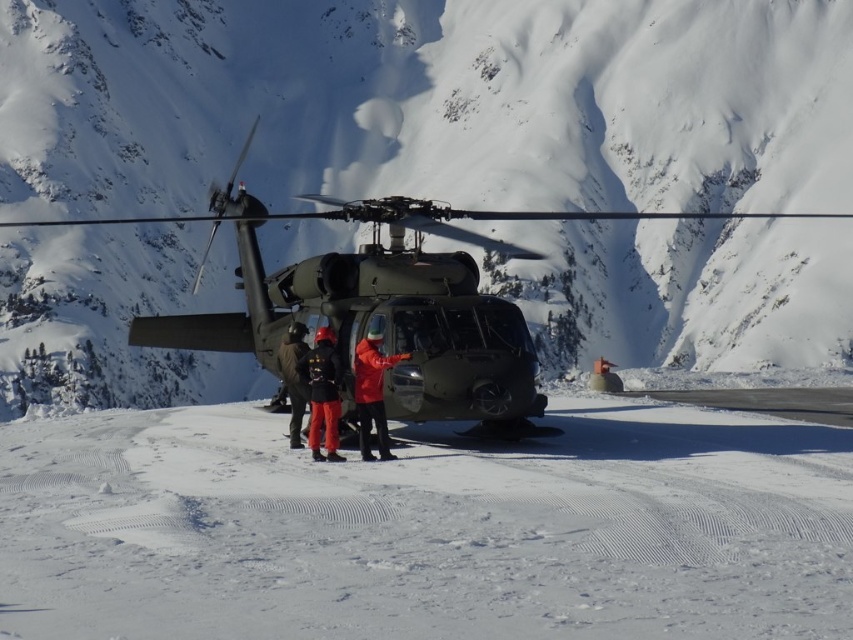
You are a photographer wanting to capture a clear photo of the matte black helicopter at center and the matte black jacket at center. Since both are matte black, you need to adjust your camera settings to avoid overexposure. Which object should you focus on first to ensure proper exposure, considering their positions?

The matte black helicopter at center is closer to the viewer than the matte black jacket at center, so you should focus on the matte black helicopter at center first to ensure proper exposure.

You are a rescue worker needing to reach the matte black helicopter at center from your current position near the red jacket at center. Given that you can walk at a steady pace of 1.5 meters per second, how many seconds will it take you to reach the helicopter?

The matte black helicopter at center and red jacket at center are 21.38 meters apart. At a walking speed of 1.5 meters per second, it will take approximately 14.25 seconds to reach the helicopter.